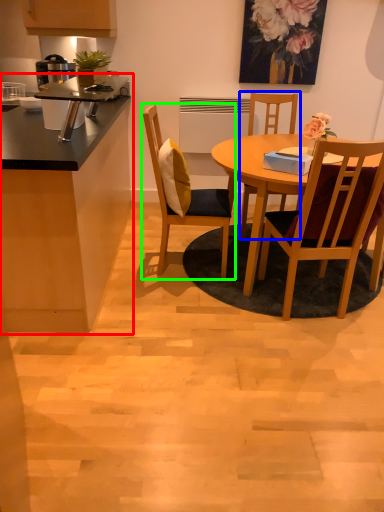
Question: Estimate the real-world distances between objects in this image. Which object is closer to cabinetry (highlighted by a red box), chair (highlighted by a blue box) or chair (highlighted by a green box)?

Choices:
 (A) chair
 (B) chair

Answer: (B)